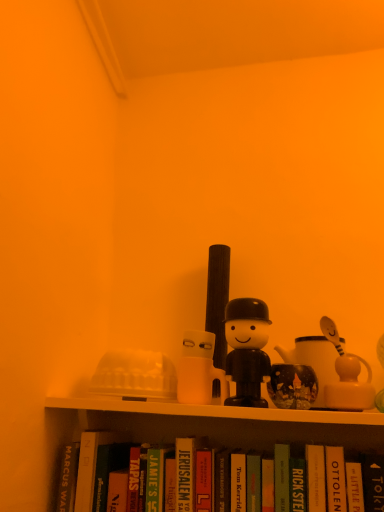
Question: Is the position of green matte paperback book at center, placed as the fourth paperback book when sorted from left to right, less distant than that of white matte mug at center, the fourth toy in the right-to-left sequence?

Choices:
 (A) no
 (B) yes

Answer: (B)

Question: From a real-world perspective, is green matte paperback book at center, which is the fourth paperback book in right-to-left order, over white matte mug at center, arranged as the 1th toy when viewed from the left?

Choices:
 (A) no
 (B) yes

Answer: (A)

Question: Does green matte paperback book at center, which is the fourth paperback book in right-to-left order, have a lesser width compared to white matte mug at center, arranged as the 1th toy when viewed from the left?

Choices:
 (A) yes
 (B) no

Answer: (B)

Question: Does green matte paperback book at center, which is the fourth paperback book in right-to-left order, have a larger size compared to white matte mug at center, arranged as the 1th toy when viewed from the left?

Choices:
 (A) no
 (B) yes

Answer: (B)

Question: Does green matte paperback book at center, placed as the fourth paperback book when sorted from left to right, contain white matte mug at center, the fourth toy in the right-to-left sequence?

Choices:
 (A) yes
 (B) no

Answer: (B)

Question: In the image, is green matte book at lower center, marked as the 7th paperback book in a right-to-left arrangement, positioned in front of or behind hardcover book at center, placed as the third paperback book when sorted from left to right?

Choices:
 (A) behind
 (B) front

Answer: (A)

Question: From a real-world perspective, is green matte book at lower center, the first paperback book from the left, positioned above or below hardcover book at center, placed as the third paperback book when sorted from left to right?

Choices:
 (A) above
 (B) below

Answer: (A)

Question: In terms of size, does green matte book at lower center, the first paperback book from the left, appear bigger or smaller than hardcover book at center, placed as the third paperback book when sorted from left to right?

Choices:
 (A) big
 (B) small

Answer: (B)

Question: Considering the positions of green matte book at lower center, marked as the 7th paperback book in a right-to-left arrangement, and hardcover book at center, placed as the third paperback book when sorted from left to right, in the image, is green matte book at lower center, marked as the 7th paperback book in a right-to-left arrangement, wider or thinner than hardcover book at center, placed as the third paperback book when sorted from left to right,?

Choices:
 (A) wide
 (B) thin

Answer: (B)

Question: Is green matte book at lower center, the first paperback book from the left, bigger or smaller than hardcover book at lower right, which appears as the sixth paperback book when viewed from the left?

Choices:
 (A) big
 (B) small

Answer: (A)

Question: From a real-world perspective, is green matte book at lower center, marked as the 7th paperback book in a right-to-left arrangement, above or below hardcover book at lower right, which is the second paperback book in right-to-left order?

Choices:
 (A) above
 (B) below

Answer: (A)

Question: From the image's perspective, relative to hardcover book at lower right, which is the second paperback book in right-to-left order, is green matte book at lower center, marked as the 7th paperback book in a right-to-left arrangement, above or below?

Choices:
 (A) below
 (B) above

Answer: (A)

Question: Does point (163, 464) appear closer or farther from the camera than point (355, 462)?

Choices:
 (A) closer
 (B) farther

Answer: (B)

Question: Considering the positions of point (203, 477) and point (221, 397), is point (203, 477) closer or farther from the camera than point (221, 397)?

Choices:
 (A) farther
 (B) closer

Answer: (B)

Question: Is hardcover book at center, which appears as the 2th paperback book when viewed from the left, spatially inside white matte mug at center, arranged as the 1th toy when viewed from the left, or outside of it?

Choices:
 (A) outside
 (B) inside

Answer: (A)